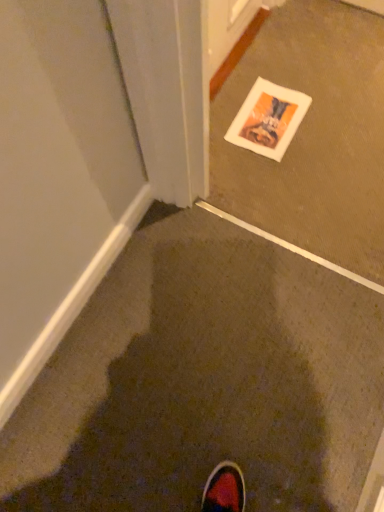
Measure the distance between white paper at center and camera.

white paper at center and camera are 1.27 meters apart.

Find the location of a particular element. This screenshot has height=512, width=384. white paper at center is located at coordinates (312, 136).

What do you see at coordinates (312, 136) in the screenshot?
I see `white paper at center` at bounding box center [312, 136].

This screenshot has width=384, height=512. In order to click on brown matte carpet at center in this screenshot , I will do `click(171, 391)`.

What do you see at coordinates (171, 391) in the screenshot?
I see `brown matte carpet at center` at bounding box center [171, 391].

Find the location of a particular element. The height and width of the screenshot is (512, 384). white paper at center is located at coordinates click(x=312, y=136).

Considering the relative positions of white paper at center and brown matte carpet at center in the image provided, is white paper at center to the left of brown matte carpet at center from the viewer's perspective?

No.

Which is in front, white paper at center or brown matte carpet at center?

brown matte carpet at center is closer to the camera.

Is point (296, 61) positioned behind point (255, 440)?

Yes, it is behind point (255, 440).

From the image's perspective, which one is positioned lower, white paper at center or brown matte carpet at center?

brown matte carpet at center is shown below in the image.

From a real-world perspective, relative to brown matte carpet at center, is white paper at center vertically above or below?

From a real-world perspective, white paper at center is physically above brown matte carpet at center.

In the scene shown: Considering the sizes of objects white paper at center and brown matte carpet at center in the image provided, who is thinner, white paper at center or brown matte carpet at center?

brown matte carpet at center is thinner.

Can you confirm if white paper at center is taller than brown matte carpet at center?

Yes.

Does white paper at center have a larger size compared to brown matte carpet at center?

Yes, white paper at center is bigger than brown matte carpet at center.

Is brown matte carpet at center inside white paper at center?

No, white paper at center does not contain brown matte carpet at center.

Is white paper at center beside brown matte carpet at center?

No, white paper at center is not beside brown matte carpet at center.

Is white paper at center positioned with its back to brown matte carpet at center?

No, brown matte carpet at center is not at the back of white paper at center.

What's the angular difference between white paper at center and brown matte carpet at center's facing directions?

The facing directions of white paper at center and brown matte carpet at center are 0.467 degrees apart.

How distant is white paper at center from brown matte carpet at center?

white paper at center and brown matte carpet at center are 22.72 inches apart.

Find the location of `mud that is on the left side of white paper at center`. mud that is on the left side of white paper at center is located at coordinates (171, 391).

Is brown matte carpet at center at the left side of white paper at center?

Indeed, brown matte carpet at center is positioned on the left side of white paper at center.

Considering their positions, is brown matte carpet at center located in front of or behind white paper at center?

Clearly, brown matte carpet at center is in front of white paper at center.

Which is closer, (15,431) or (278,184)?

Point (15,431)

In the scene shown: From the image's perspective, who appears lower, brown matte carpet at center or white paper at center?

From the image's view, brown matte carpet at center is below.

From a real-world perspective, is brown matte carpet at center positioned above or below white paper at center?

From a real-world perspective, brown matte carpet at center is physically below white paper at center.

Which of these two, brown matte carpet at center or white paper at center, is wider?

white paper at center is wider.

Can you confirm if brown matte carpet at center is shorter than white paper at center?

Indeed, brown matte carpet at center has a lesser height compared to white paper at center.

Does brown matte carpet at center have a smaller size compared to white paper at center?

Yes, brown matte carpet at center is smaller than white paper at center.

Would you say brown matte carpet at center is outside white paper at center?

brown matte carpet at center is positioned outside white paper at center.

Does brown matte carpet at center touch white paper at center?

A: brown matte carpet at center is not next to white paper at center, and they're not touching.

Is brown matte carpet at center oriented towards white paper at center?

No, brown matte carpet at center is not oriented towards white paper at center.

The width and height of the screenshot is (384, 512). In order to click on mud in front of the white paper at center in this screenshot , I will do `click(171, 391)`.

The width and height of the screenshot is (384, 512). What are the coordinates of `concrete lying above the brown matte carpet at center (from the image's perspective)` in the screenshot? It's located at (312, 136).

Locate an element on the screen. This screenshot has height=512, width=384. concrete that is on the right side of brown matte carpet at center is located at coordinates (312, 136).